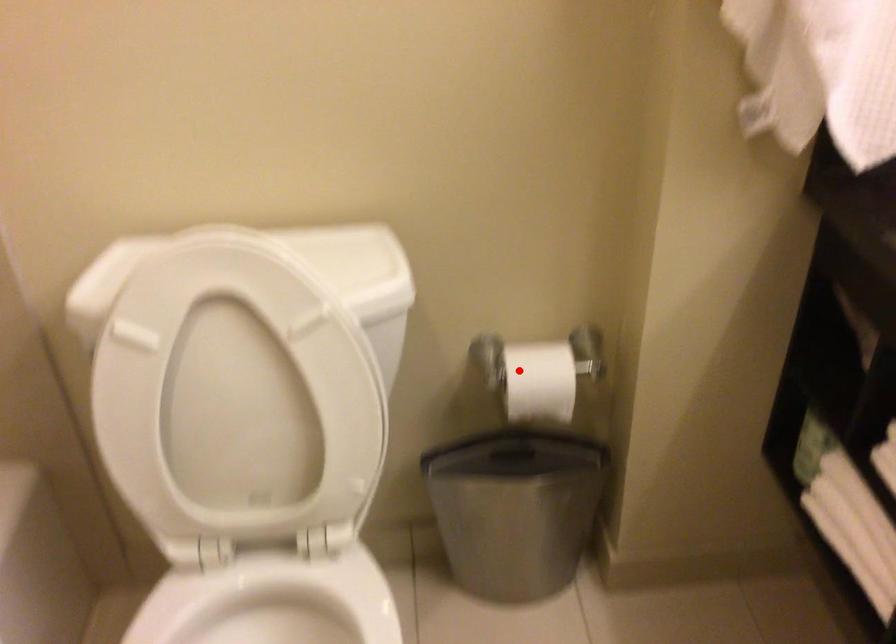
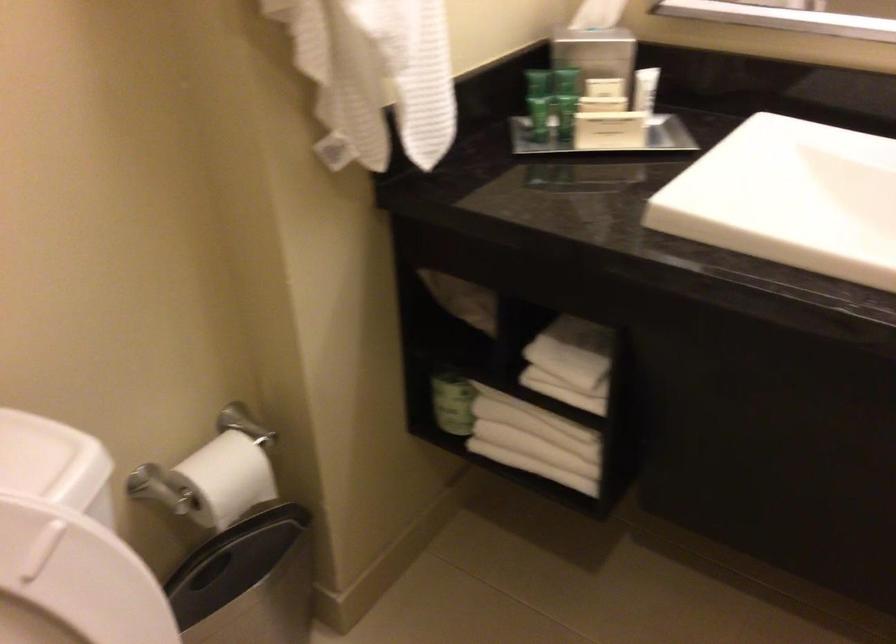
Question: A red point is marked in image1. In image2, is the corresponding 3D point closer to the camera or farther? Reply with the corresponding letter.

Choices:
 (A) The corresponding 3D point is closer.
 (B) The corresponding 3D point is farther.

Answer: (A)